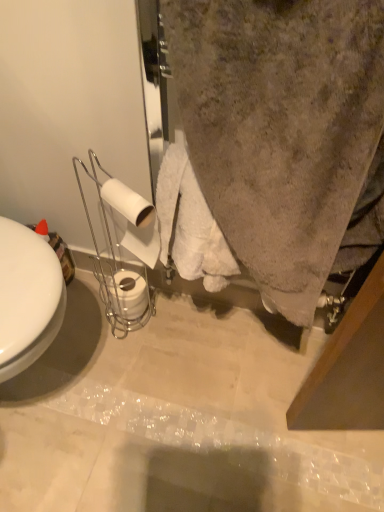
Question: Is white matte toilet paper at center left, the 1th toilet paper when ordered from top to bottom, taller or shorter than white matte toilet paper at lower center, arranged as the 2th toilet paper when viewed from the front?

Choices:
 (A) short
 (B) tall

Answer: (B)

Question: In terms of width, does white matte toilet paper at center left, the 1th toilet paper when ordered from front to back, look wider or thinner when compared to white matte toilet paper at lower center, acting as the first toilet paper starting from the bottom?

Choices:
 (A) wide
 (B) thin

Answer: (B)

Question: From the image's perspective, relative to white matte toilet paper at lower center, arranged as the 2th toilet paper when viewed from the front, is white matte toilet paper at center left, acting as the 2th toilet paper starting from the bottom, above or below?

Choices:
 (A) below
 (B) above

Answer: (B)

Question: From the image's perspective, is white matte toilet paper at lower center, the 1th toilet paper viewed from the back, positioned above or below white matte toilet paper at center left, the 1th toilet paper when ordered from top to bottom?

Choices:
 (A) below
 (B) above

Answer: (A)

Question: From a real-world perspective, is white matte toilet paper at lower center, arranged as the 2th toilet paper when viewed from the front, positioned above or below white matte toilet paper at center left, acting as the 2th toilet paper starting from the bottom?

Choices:
 (A) below
 (B) above

Answer: (A)

Question: Would you say white matte toilet paper at lower center, the 2th toilet paper when ordered from top to bottom, is to the left or to the right of white matte toilet paper at center left, the 2th toilet paper when ordered from back to front, in the picture?

Choices:
 (A) left
 (B) right

Answer: (A)

Question: Considering the positions of white matte toilet paper at lower center, arranged as the 2th toilet paper when viewed from the front, and white matte toilet paper at center left, acting as the 2th toilet paper starting from the bottom, in the image, is white matte toilet paper at lower center, arranged as the 2th toilet paper when viewed from the front, taller or shorter than white matte toilet paper at center left, acting as the 2th toilet paper starting from the bottom,?

Choices:
 (A) tall
 (B) short

Answer: (B)